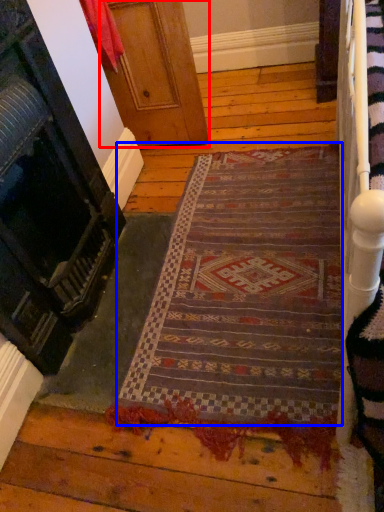
Question: Which object appears closest to the camera in this image, door (highlighted by a red box) or mat (highlighted by a blue box)?

Choices:
 (A) door
 (B) mat

Answer: (B)